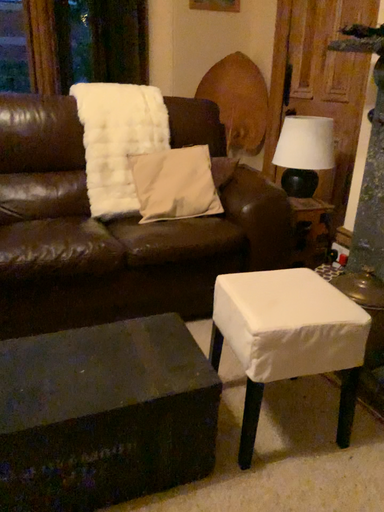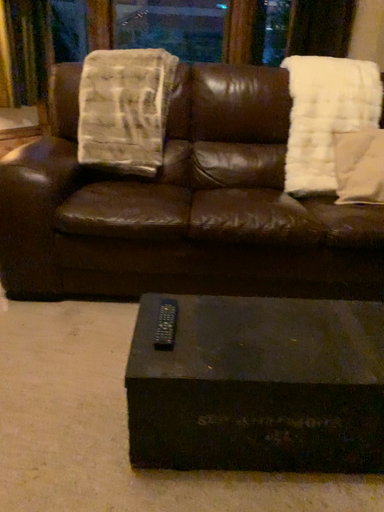
Question: Which way did the camera rotate in the video?

Choices:
 (A) rotated right
 (B) rotated left

Answer: (B)